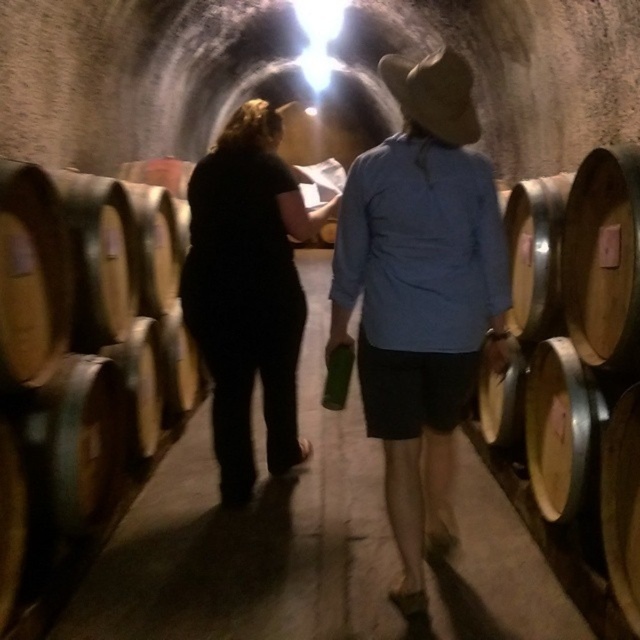
Is wooden barrel at left shorter than wooden barrel at right?

In fact, wooden barrel at left may be taller than wooden barrel at right.

Between point (88, 403) and point (592, 420), which one is positioned behind?

Positioned behind is point (88, 403).

You are a GUI agent. You are given a task and a screenshot of the screen. Output one action in this format:
    pyautogui.click(x=<x>, y=<y>)
    Task: Click on the wooden barrel at left
    
    Given the screenshot: What is the action you would take?
    pyautogui.click(x=81, y=372)

Based on the photo, between matte black shirt at center and black matte pants at center, which one is positioned higher?

black matte pants at center is higher up.

Does matte black shirt at center appear under black matte pants at center?

Yes, matte black shirt at center is below black matte pants at center.

The height and width of the screenshot is (640, 640). Describe the element at coordinates (420, 296) in the screenshot. I see `matte black shirt at center` at that location.

The image size is (640, 640). What are the coordinates of `matte black shirt at center` in the screenshot? It's located at point(420,296).

Which is more to the right, matte black shirt at center or wooden barrel at right?

Positioned to the right is wooden barrel at right.

Is point (484, 289) more distant than point (564, 369)?

No, (484, 289) is closer to viewer.

Does point (422, 168) come farther from viewer compared to point (595, 284)?

No.

Image resolution: width=640 pixels, height=640 pixels. I want to click on matte black shirt at center, so click(420, 296).